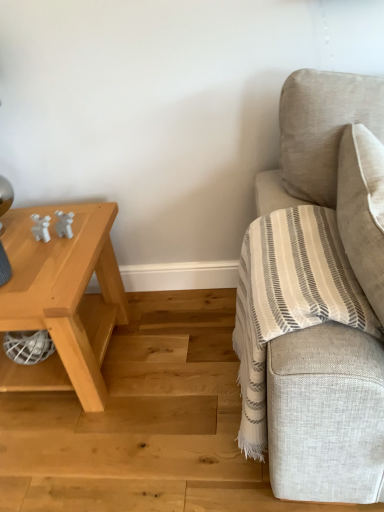
The image size is (384, 512). Find the location of `spots to the right of light wood table at left`. spots to the right of light wood table at left is located at coordinates (175, 358).